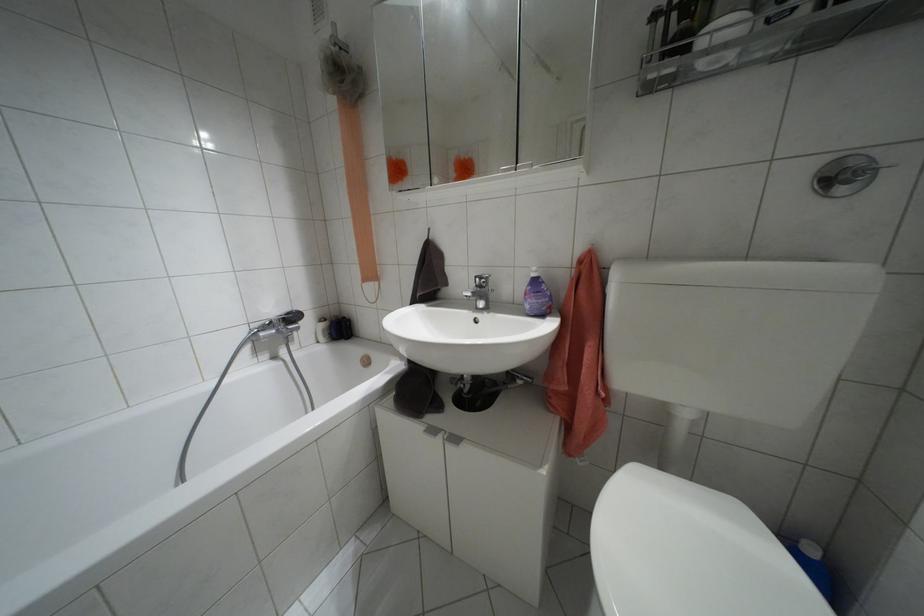
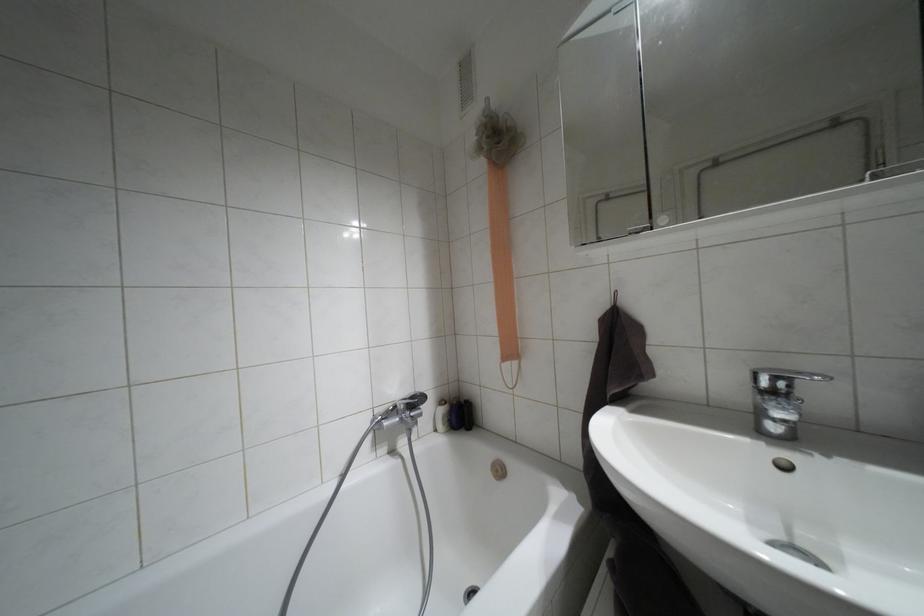
What movement of the cameraman would produce the second image?

The cameraman walked toward left, forward.